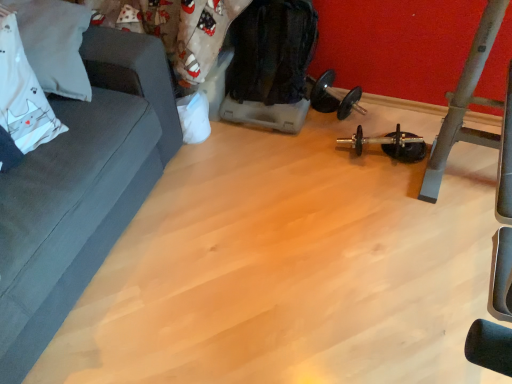
Question: Based on their positions, is dark gray fabric couch at left located to the left or right of black rubber dumbbell at center?

Choices:
 (A) left
 (B) right

Answer: (A)

Question: In the image, is dark gray fabric couch at left positioned in front of or behind black rubber dumbbell at center?

Choices:
 (A) front
 (B) behind

Answer: (A)

Question: Which object is positioned farthest from the white fabric pillow at upper left?

Choices:
 (A) dark gray fabric couch at left
 (B) black rubber dumbbell at center

Answer: (B)

Question: Estimate the real-world distances between objects in this image. Which object is closer to the white fabric pillow at upper left?

Choices:
 (A) dark gray fabric couch at left
 (B) black rubber dumbbell at center

Answer: (A)